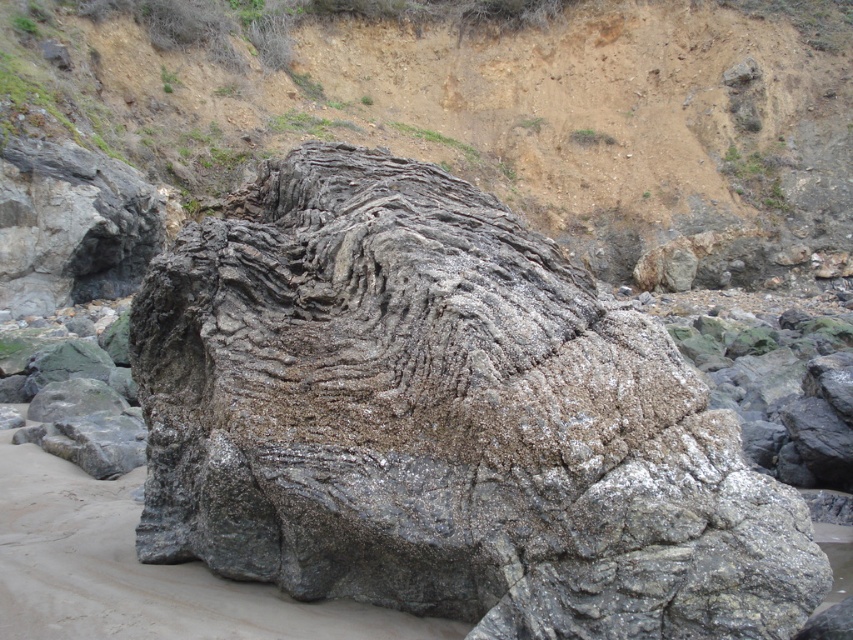
Who is higher up, gray rough rock at center or dull brown rock at center?

dull brown rock at center is higher up.

Which is more to the right, gray rough rock at center or dull brown rock at center?

dull brown rock at center

At what (x,y) coordinates should I click in order to perform the action: click on gray rough rock at center. Please return your answer as a coordinate pair (x, y). Looking at the image, I should click on (444, 420).